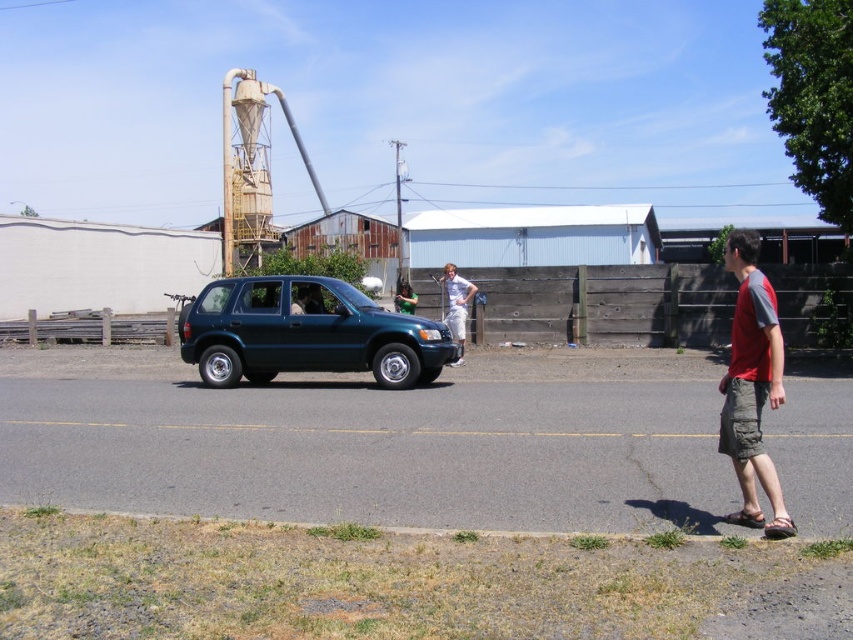
Question: Which of the following is the closest to the observer?

Choices:
 (A) rusty metal water tower at upper left
 (B) red cotton shirt at right
 (C) white matte pants at center
 (D) glossy dark green suv at center

Answer: (B)

Question: Is glossy dark green suv at center positioned behind green fabric shirt at center?

Choices:
 (A) no
 (B) yes

Answer: (A)

Question: Which point is closer to the camera taking this photo?

Choices:
 (A) (463, 300)
 (B) (403, 285)
 (C) (254, 205)

Answer: (A)

Question: Can you confirm if red cotton shirt at right is thinner than rusty metal water tower at upper left?

Choices:
 (A) no
 (B) yes

Answer: (B)

Question: Is glossy dark green suv at center behind white matte pants at center?

Choices:
 (A) yes
 (B) no

Answer: (B)

Question: Which of the following is the farthest from the observer?

Choices:
 (A) (450, 284)
 (B) (399, 292)
 (C) (439, 333)

Answer: (B)